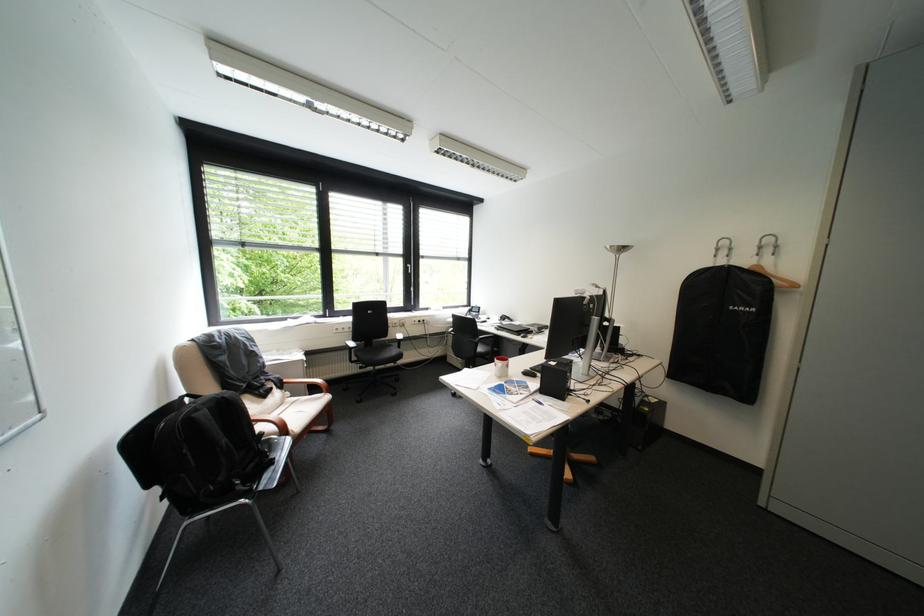
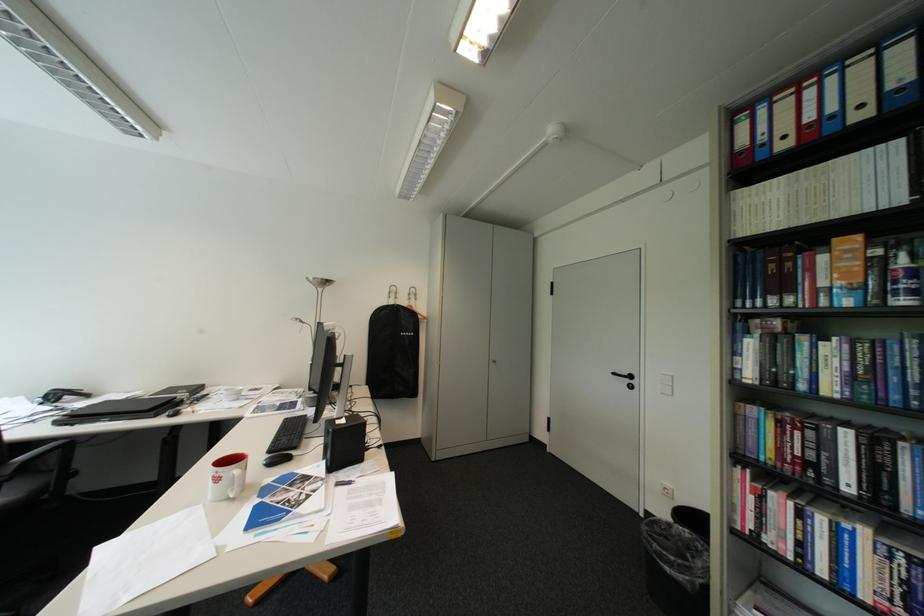
Question: The images are taken continuously from a first-person perspective. In which direction is your viewpoint rotating?

Choices:
 (A) Left
 (B) Right
 (C) Up
 (D) Down

Answer: (B)